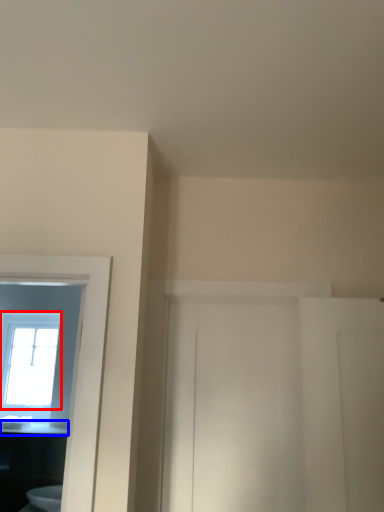
Question: Which of the following is the farthest to the observer, window (highlighted by a red box) or counter top (highlighted by a blue box)?

Choices:
 (A) window
 (B) counter top

Answer: (A)